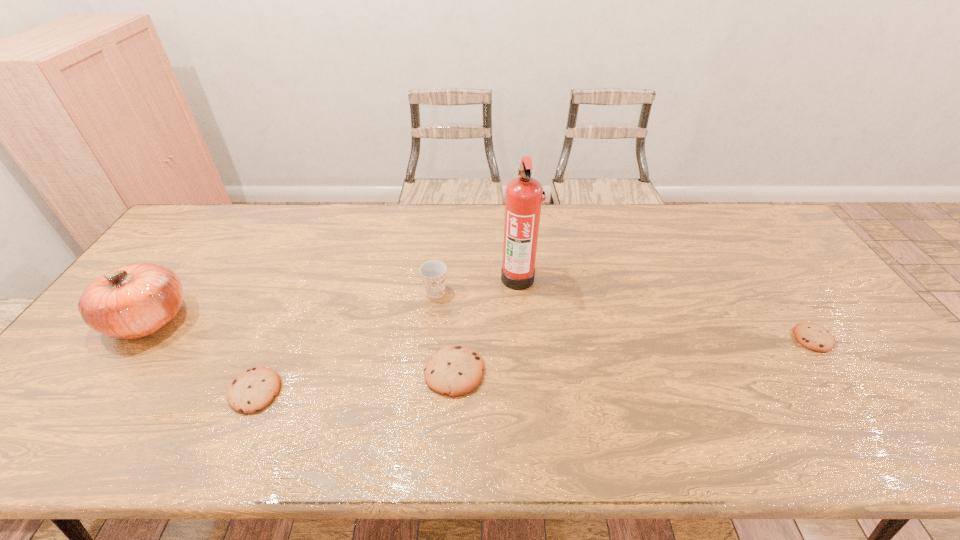
Locate an element on the screen. The width and height of the screenshot is (960, 540). the second object from right to left is located at coordinates (523, 200).

This screenshot has width=960, height=540. In order to click on vacant area situated on the left of the second tallest cookie in this screenshot , I will do `click(167, 392)`.

Where is `free space located 0.150m on the left of the fourth tallest object`? free space located 0.150m on the left of the fourth tallest object is located at coordinates (364, 373).

What are the coordinates of `vacant area situated on the back of the rightmost object` in the screenshot? It's located at (746, 242).

Image resolution: width=960 pixels, height=540 pixels. Identify the location of free space located 0.270m on the back of the Dixie cup. (442, 229).

I want to click on vacant space located 0.180m on the back of the second tallest object, so click(x=198, y=252).

At what (x,y) coordinates should I click in order to perform the action: click on vacant area situated 0.060m with the nozzle pointing from the back of the tallest object. Please return your answer as a coordinate pair (x, y). This screenshot has height=540, width=960. Looking at the image, I should click on (481, 278).

What are the coordinates of `vacant space situated with the nozzle pointing from the back of the tallest object` in the screenshot? It's located at (471, 278).

Identify the location of free spot located with the nozzle pointing from the back of the tallest object. (406, 278).

Identify the location of object located in the left edge section of the desktop. (132, 301).